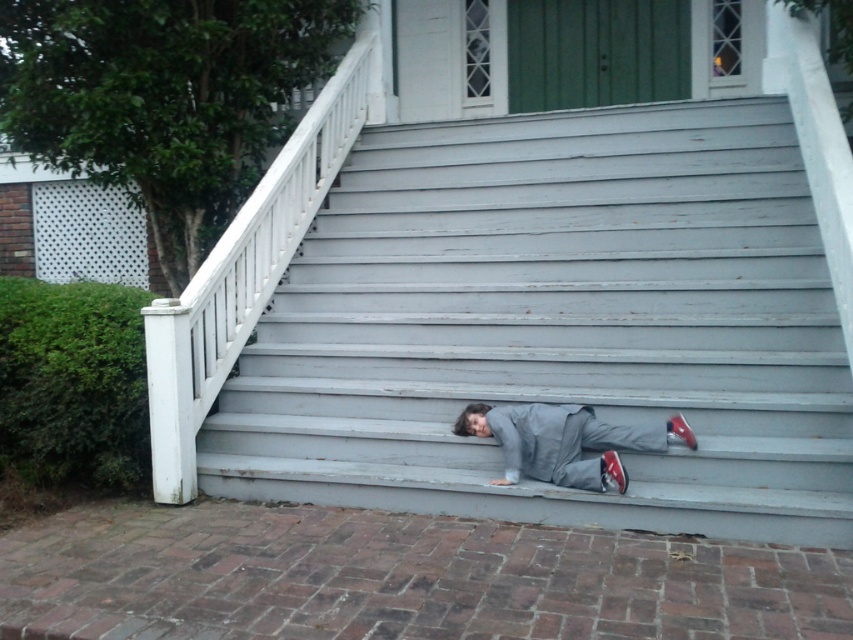
Does shiny red sneaker at lower right come behind shiny red shoe at lower right?

No, it is in front of shiny red shoe at lower right.

Measure the distance between shiny red sneaker at lower right and shiny red shoe at lower right.

shiny red sneaker at lower right is 12.05 inches from shiny red shoe at lower right.

Image resolution: width=853 pixels, height=640 pixels. In order to click on shiny red sneaker at lower right in this screenshot , I will do `click(614, 470)`.

Between gray matte jacket at lower center and shiny red shoe at lower right, which one appears on the right side from the viewer's perspective?

Positioned to the right is shiny red shoe at lower right.

Can you confirm if gray matte jacket at lower center is smaller than shiny red shoe at lower right?

Actually, gray matte jacket at lower center might be larger than shiny red shoe at lower right.

Does point (619, 484) come behind point (672, 422)?

That is False.

You are a GUI agent. You are given a task and a screenshot of the screen. Output one action in this format:
    pyautogui.click(x=<x>, y=<y>)
    Task: Click on the gray matte jacket at lower center
    The height and width of the screenshot is (640, 853).
    Given the screenshot: What is the action you would take?
    pyautogui.click(x=564, y=442)

Who is lower down, gray matte jacket at lower center or shiny red sneaker at lower right?

shiny red sneaker at lower right

Does gray matte jacket at lower center have a larger size compared to shiny red sneaker at lower right?

Yes.

Image resolution: width=853 pixels, height=640 pixels. Describe the element at coordinates (564, 442) in the screenshot. I see `gray matte jacket at lower center` at that location.

Locate an element on the screen. This screenshot has width=853, height=640. gray matte jacket at lower center is located at coordinates (564, 442).